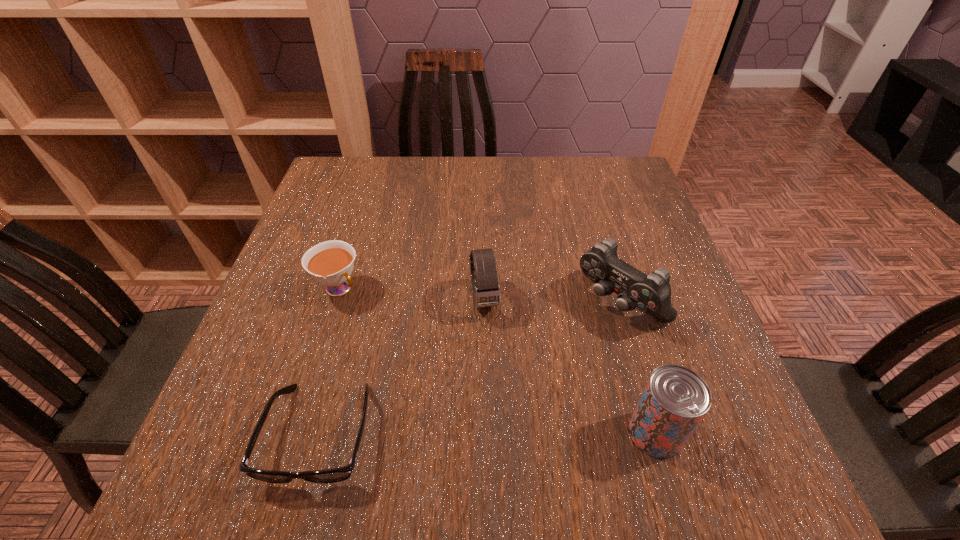
Where is `the shortest object`? The height and width of the screenshot is (540, 960). the shortest object is located at coordinates (340, 474).

I want to click on beer can, so click(x=675, y=399).

At what (x,y) coordinates should I click in order to perform the action: click on watch. Please return your answer as a coordinate pair (x, y). Looking at the image, I should click on (486, 292).

You are a GUI agent. You are given a task and a screenshot of the screen. Output one action in this format:
    pyautogui.click(x=<x>, y=<y>)
    Task: Click on the second shortest object
    The width and height of the screenshot is (960, 540).
    Given the screenshot: What is the action you would take?
    pyautogui.click(x=331, y=263)

Find the location of a particular element. This screenshot has height=540, width=960. control is located at coordinates (651, 294).

Image resolution: width=960 pixels, height=540 pixels. Find the location of `free spot located on the back of the beer can`. free spot located on the back of the beer can is located at coordinates click(640, 383).

At what (x,y) coordinates should I click in order to perform the action: click on vacant space situated 0.170m on the face of the third object from right to left. Please return your answer as a coordinate pair (x, y). Looking at the image, I should click on [x=501, y=397].

Identify the location of vacant space located on the face of the third object from right to left. Image resolution: width=960 pixels, height=540 pixels. (505, 418).

The image size is (960, 540). In order to click on vacant space located 0.150m on the face of the third object from right to left in this screenshot , I will do `click(499, 387)`.

The image size is (960, 540). Identify the location of vacant space located on the side of the teacup with the handle. coord(399,340).